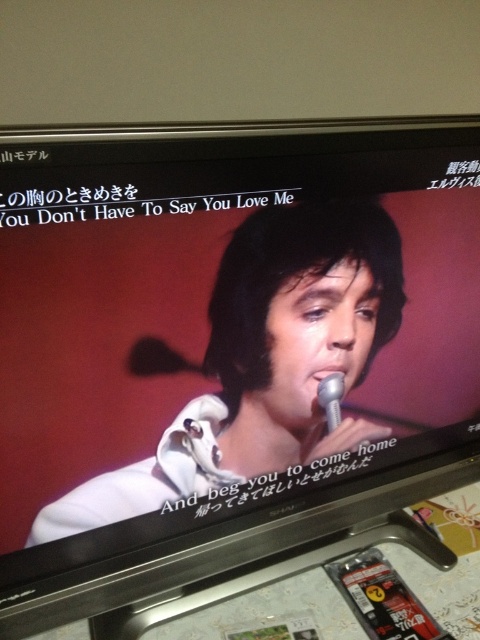
You are a photographer trying to capture the singer holding the metallic silver microphone at center and wearing the white matte jacket at center. From your current position, which object would you focus on first if you want to ensure both are in frame?

The white matte jacket at center is to the left of the metallic silver microphone at center, so you should focus on the metallic silver microphone at center first to ensure both are in frame.

Consider the image. You are a stagehand who needs to ensure that the white matte jacket at center and the metallic silver microphone at center are visible to the audience. Since the microphone is smaller, where should you position it relative to the jacket?

The white matte jacket at center is bigger than the metallic silver microphone at center, so positioning the metallic silver microphone at center closer to the front or slightly elevated would help ensure it remains visible despite its smaller size.